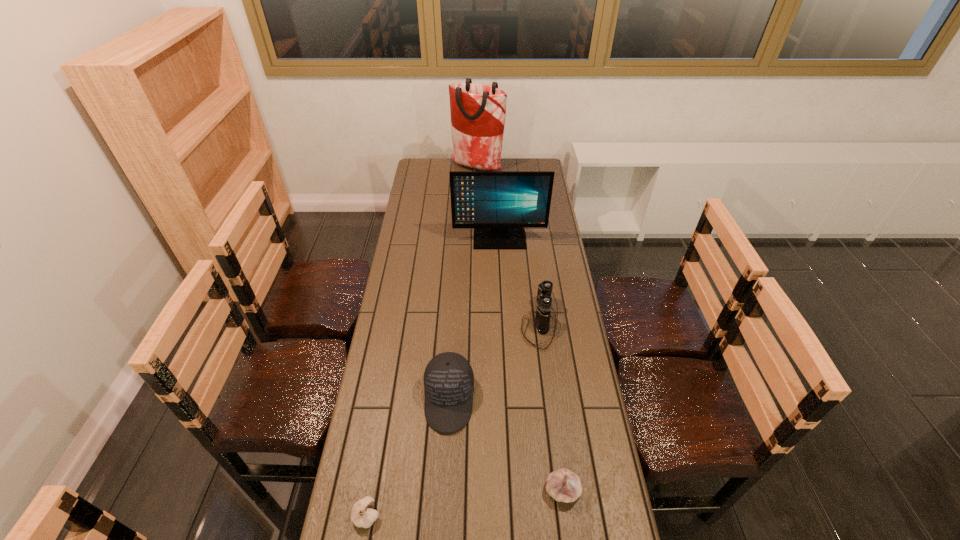
Locate an element on the screen. The height and width of the screenshot is (540, 960). free space located 0.080m on the screen side of the monitor is located at coordinates (500, 261).

You are a GUI agent. You are given a task and a screenshot of the screen. Output one action in this format:
    pyautogui.click(x=<x>, y=<y>)
    Task: Click on the vacant space located 0.210m at the front of the baseball cap where the brim is located
    
    Given the screenshot: What is the action you would take?
    pyautogui.click(x=443, y=508)

Locate an element on the screen. This screenshot has width=960, height=540. blank area located 0.300m on the front of the fourth nearest object is located at coordinates (553, 431).

Identify the location of free space located on the left of the taller garlic. The height and width of the screenshot is (540, 960). (434, 490).

What are the coordinates of `vacant space located on the back of the shortest object` in the screenshot? It's located at (380, 438).

You are a GUI agent. You are given a task and a screenshot of the screen. Output one action in this format:
    pyautogui.click(x=<x>, y=<y>)
    Task: Click on the object located in the far edge section of the desktop
    
    Given the screenshot: What is the action you would take?
    pyautogui.click(x=478, y=111)

Identify the location of object that is at the left edge. This screenshot has width=960, height=540. (362, 515).

Identify the location of monitor present at the right edge. (498, 205).

The image size is (960, 540). I want to click on binoculars present at the right edge, so click(x=542, y=319).

The width and height of the screenshot is (960, 540). Find the location of `garlic present at the right edge`. garlic present at the right edge is located at coordinates (563, 485).